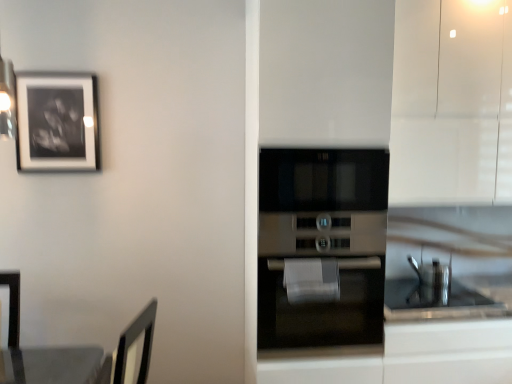
Question: Is stainless steel oven at center taller than white glossy cabinet at upper right?

Choices:
 (A) yes
 (B) no

Answer: (B)

Question: Considering the relative sizes of stainless steel oven at center and white glossy cabinet at upper right in the image provided, is stainless steel oven at center thinner than white glossy cabinet at upper right?

Choices:
 (A) no
 (B) yes

Answer: (A)

Question: From the image's perspective, is stainless steel oven at center on top of white glossy cabinet at upper right?

Choices:
 (A) no
 (B) yes

Answer: (A)

Question: Can you confirm if stainless steel oven at center is shorter than white glossy cabinet at upper right?

Choices:
 (A) no
 (B) yes

Answer: (B)

Question: Is stainless steel oven at center facing away from white glossy cabinet at upper right?

Choices:
 (A) yes
 (B) no

Answer: (B)

Question: Does stainless steel oven at center have a greater width compared to white glossy cabinet at upper right?

Choices:
 (A) no
 (B) yes

Answer: (B)

Question: Is stainless steel oven at center bigger than black matte picture frame at upper left?

Choices:
 (A) no
 (B) yes

Answer: (B)

Question: Can you confirm if stainless steel oven at center is thinner than black matte picture frame at upper left?

Choices:
 (A) no
 (B) yes

Answer: (A)

Question: Would you say stainless steel oven at center contains black matte picture frame at upper left?

Choices:
 (A) no
 (B) yes

Answer: (A)

Question: Can we say stainless steel oven at center lies outside black matte picture frame at upper left?

Choices:
 (A) yes
 (B) no

Answer: (A)

Question: Does stainless steel oven at center come behind black matte picture frame at upper left?

Choices:
 (A) yes
 (B) no

Answer: (B)

Question: Is stainless steel oven at center wider than black matte picture frame at upper left?

Choices:
 (A) no
 (B) yes

Answer: (B)

Question: Is white glossy cabinet at upper right aimed at stainless steel oven at center?

Choices:
 (A) no
 (B) yes

Answer: (A)